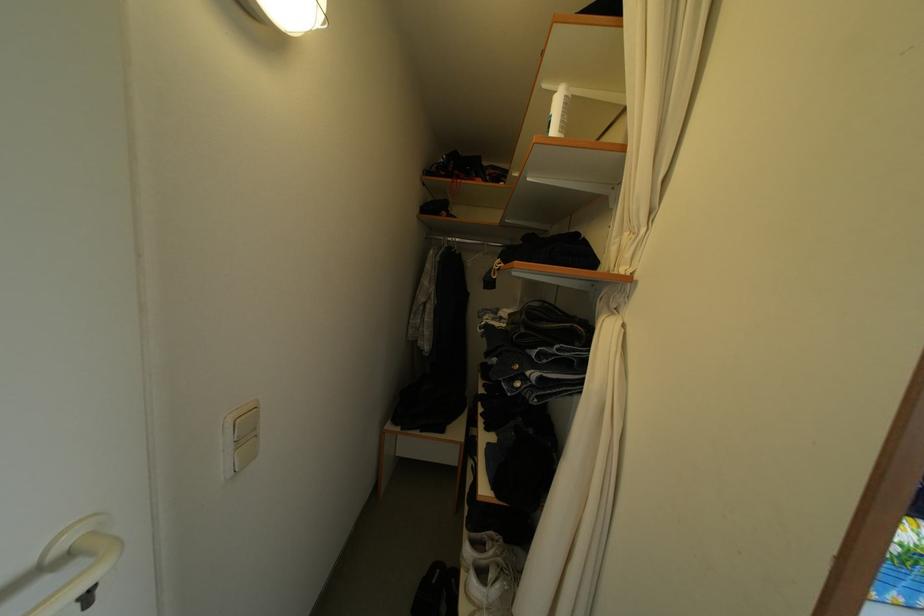
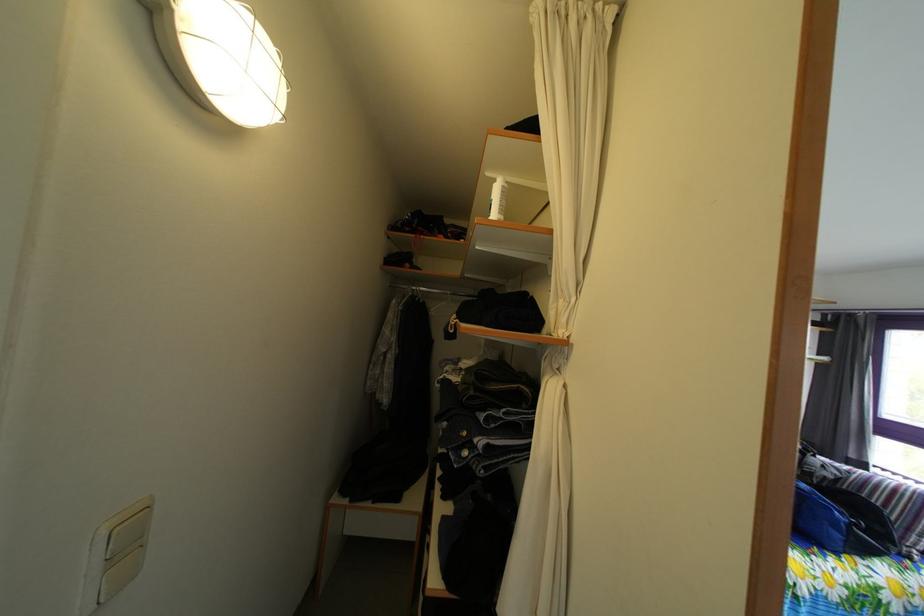
Locate, in the second image, the point that corresponds to pixel 555 94 in the first image.

(499, 182)